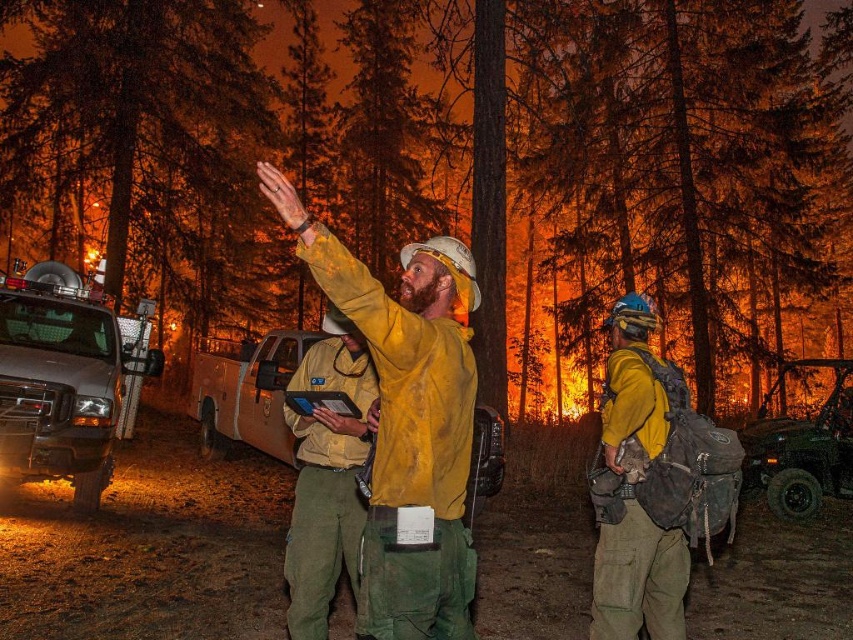
You are a firefighter trying to locate your equipment truck in the dark forest. You see the yellow matte jacket at right and the matte yellow truck at center. Which object is nearer to you?

The yellow matte jacket at right is closer to the viewer than the matte yellow truck at center, so the jacket is nearer.

You are a firefighter in the scene. Your team needs to move the yellow fire resistant jacket at center to a safer location. The jacket is currently at point (326, 476). Which direction should you move it to get away from the fire? Please answer with either left, right, up, or down.

The yellow fire resistant jacket at center is located at point (326, 476). To move it away from the fire, you should move it to the left.